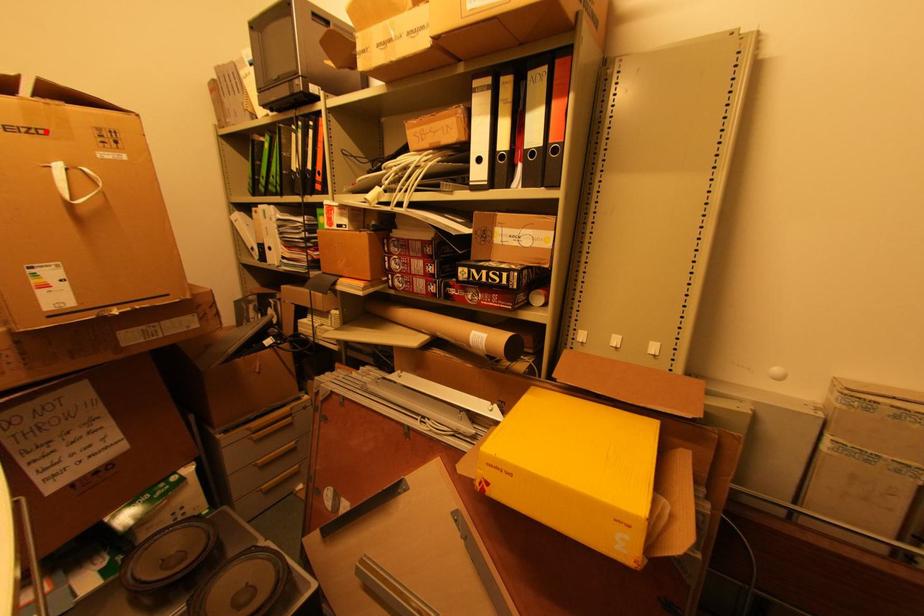
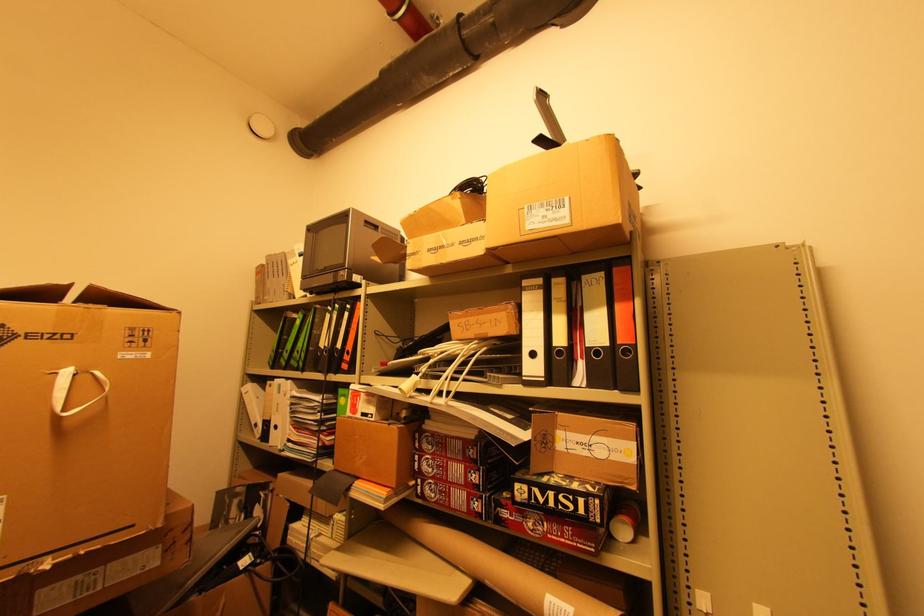
The point at the highlighted location is marked in the first image. Where is the corresponding point in the second image?

(70, 338)